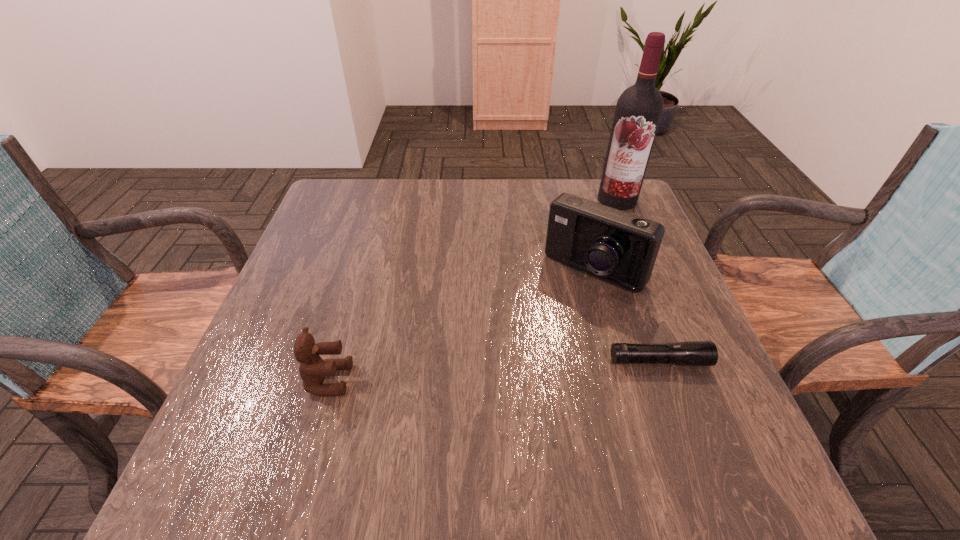
The image size is (960, 540). I want to click on vacant space on the desktop that is between the teddy bear and the flashlight and is positioned on the label of the wine bottle, so click(475, 372).

Identify the location of free space on the desktop that is between the third tallest object and the flashlight and is positioned on the front-facing side of the camera. This screenshot has height=540, width=960. (508, 370).